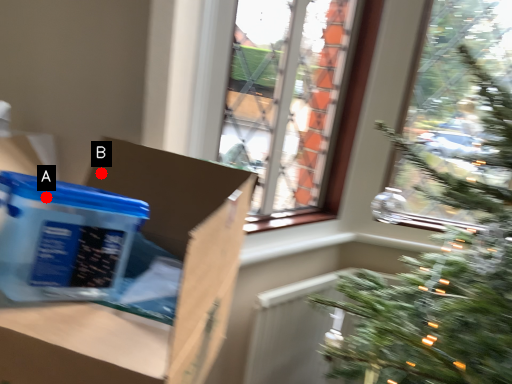
Question: Two points are circled on the image, labeled by A and B beside each circle. Which point appears farthest from the camera in this image?

Choices:
 (A) A is further
 (B) B is further

Answer: (B)